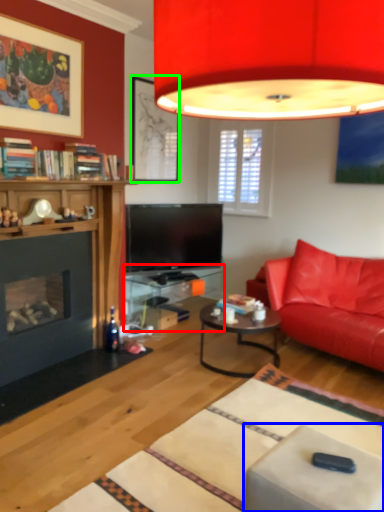
Question: Which object is the farthest from table (highlighted by a red box)? Choose among these: swivel chair (highlighted by a blue box) or picture frame (highlighted by a green box).

Choices:
 (A) swivel chair
 (B) picture frame

Answer: (A)